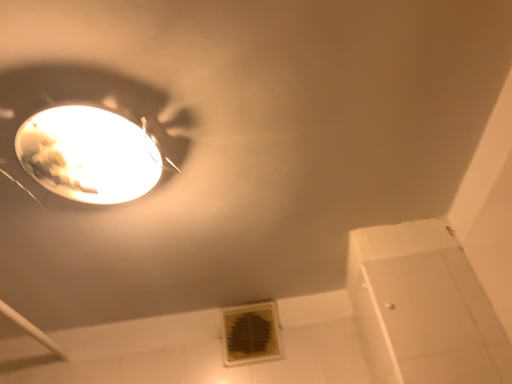
Question: Relative to matte white lamp at upper left, is white plastic air conditioning at lower center in front or behind?

Choices:
 (A) front
 (B) behind

Answer: (B)

Question: Would you say white plastic air conditioning at lower center is to the left or to the right of matte white lamp at upper left in the picture?

Choices:
 (A) left
 (B) right

Answer: (B)

Question: In terms of height, does white plastic air conditioning at lower center look taller or shorter compared to matte white lamp at upper left?

Choices:
 (A) tall
 (B) short

Answer: (A)

Question: Is matte white lamp at upper left situated inside white plastic air conditioning at lower center or outside?

Choices:
 (A) outside
 (B) inside

Answer: (A)

Question: From a real-world perspective, is matte white lamp at upper left positioned above or below white plastic air conditioning at lower center?

Choices:
 (A) above
 (B) below

Answer: (A)

Question: Is point (78, 102) closer or farther from the camera than point (266, 316)?

Choices:
 (A) closer
 (B) farther

Answer: (A)

Question: Relative to white plastic air conditioning at lower center, is matte white lamp at upper left in front or behind?

Choices:
 (A) front
 (B) behind

Answer: (A)